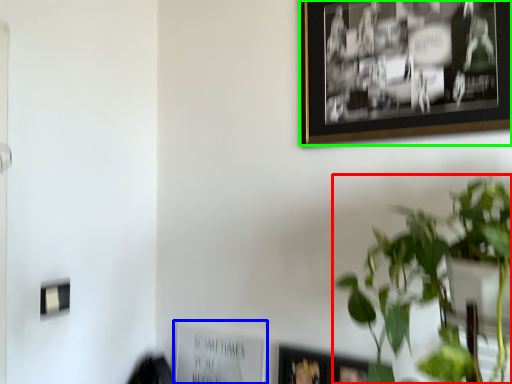
Question: Which object is the closest to the houseplant (highlighted by a red box)? Choose among these: picture frame (highlighted by a blue box) or picture frame (highlighted by a green box).

Choices:
 (A) picture frame
 (B) picture frame

Answer: (B)